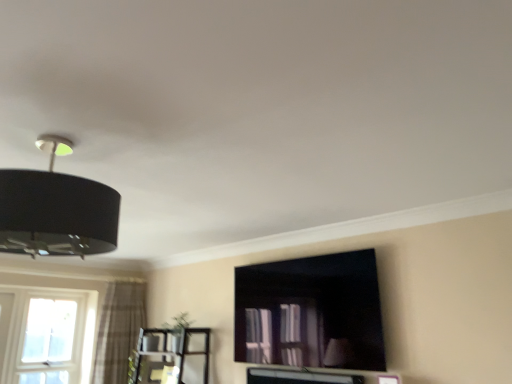
Question: Relative to metallic silver entertainment center at lower left, is black matte lampshade at upper left in front or behind?

Choices:
 (A) front
 (B) behind

Answer: (A)

Question: From the image's perspective, is black matte lampshade at upper left above or below metallic silver entertainment center at lower left?

Choices:
 (A) above
 (B) below

Answer: (A)

Question: Which of these objects is positioned closest to the plaid fabric curtain at left?

Choices:
 (A) metallic silver entertainment center at lower left
 (B) black matte lampshade at upper left
 (C) matte black tv cabinet at center
 (D) clear glass window at lower left

Answer: (D)

Question: Estimate the real-world distances between objects in this image. Which object is farther from the black matte lampshade at upper left?

Choices:
 (A) clear glass window at lower left
 (B) matte black tv cabinet at center
 (C) plaid fabric curtain at left
 (D) metallic silver entertainment center at lower left

Answer: (A)